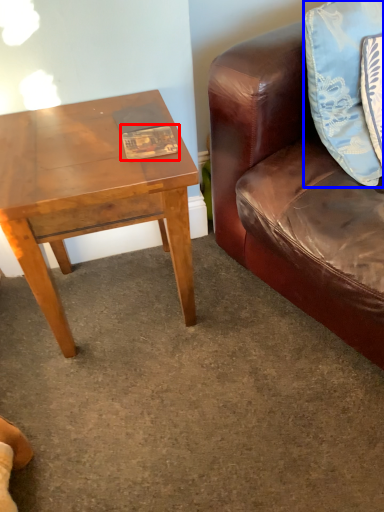
Question: Which of the following is the closest to the observer, book (highlighted by a red box) or pillow (highlighted by a blue box)?

Choices:
 (A) book
 (B) pillow

Answer: (B)